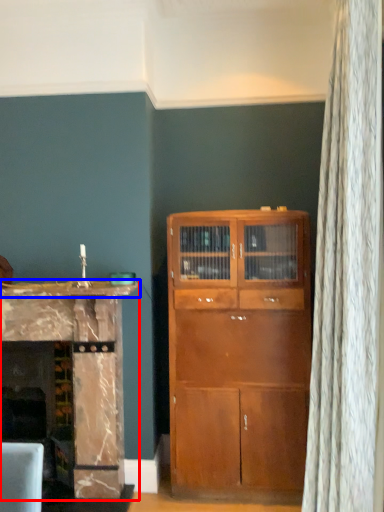
Question: Which of the following is the closest to the observer, cabinetry (highlighted by a red box) or counter top (highlighted by a blue box)?

Choices:
 (A) cabinetry
 (B) counter top

Answer: (B)